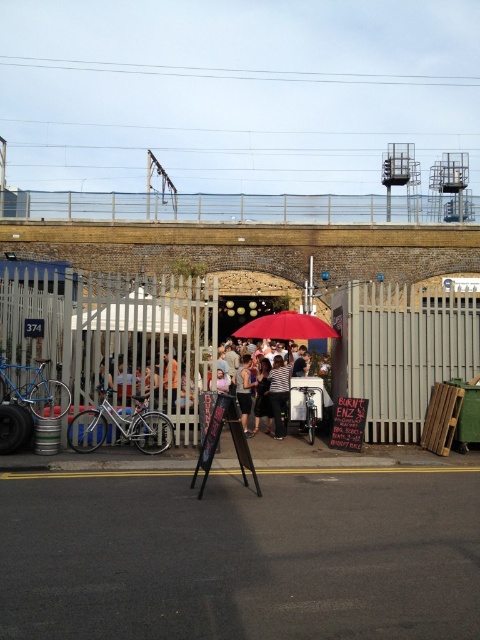
You are standing at the bottom left corner of the image. You want to walk to the matte black easel at center. Which direction should you move first?

Since the matte black easel at center is located at point 0.688 on the x axis and 0.456 on the y axis, you should first move to the right because the x coordinate is greater than 0.5, indicating it is to the right of the center of the image. After moving right, you can then adjust your vertical position based on the y coordinate.

You are standing at the bottom left corner of the image where the asphalt is visible. You want to walk towards the group behind the white wooden fence at center. Which direction should you move first?

The white wooden fence at center is located at point 0.523 on the x axis and 0.235 on the y axis. Since you are at the bottom left corner, you should move diagonally towards the right and upwards to reach the white wooden fence at center.

You are a photographer trying to capture a clear shot of the brown leather jacket at center. The white wooden fence at center is blocking your view. Can you estimate whether the fence is tall enough to completely obscure the jacket from your current position?

The white wooden fence at center is much taller than the brown leather jacket at center, so it would completely block the view of the jacket from your current position.